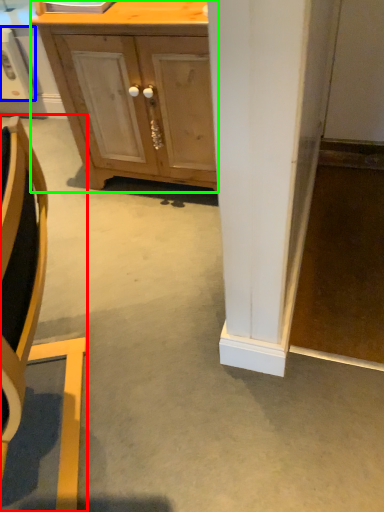
Question: Which is farther away from chair (highlighted by a red box)? appliance (highlighted by a blue box) or cabinetry (highlighted by a green box)?

Choices:
 (A) appliance
 (B) cabinetry

Answer: (A)